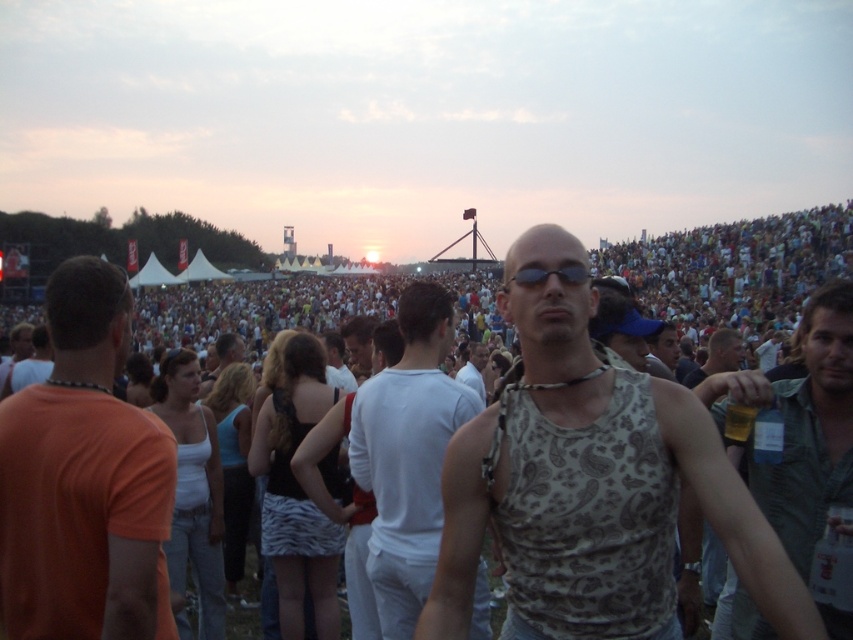
Question: Can you confirm if white cotton tank top at center is positioned to the right of light brown hair at center?

Choices:
 (A) yes
 (B) no

Answer: (B)

Question: Is the position of patterned tank top at center less distant than that of white tank top at center?

Choices:
 (A) yes
 (B) no

Answer: (A)

Question: Which object is farther from the camera taking this photo?

Choices:
 (A) printed cotton tank top at center
 (B) orange t-shirt at left
 (C) green textured shirt at center

Answer: (C)

Question: Which object is farther from the camera taking this photo?

Choices:
 (A) white tank top at center
 (B) orange t-shirt at left

Answer: (A)

Question: Considering the relative positions of printed cotton tank top at center and patterned tank top at center in the image provided, where is printed cotton tank top at center located with respect to patterned tank top at center?

Choices:
 (A) above
 (B) below

Answer: (B)

Question: Which point is closer to the camera?

Choices:
 (A) (294, 282)
 (B) (476, 362)
 (C) (610, 365)
 (D) (686, 378)

Answer: (C)